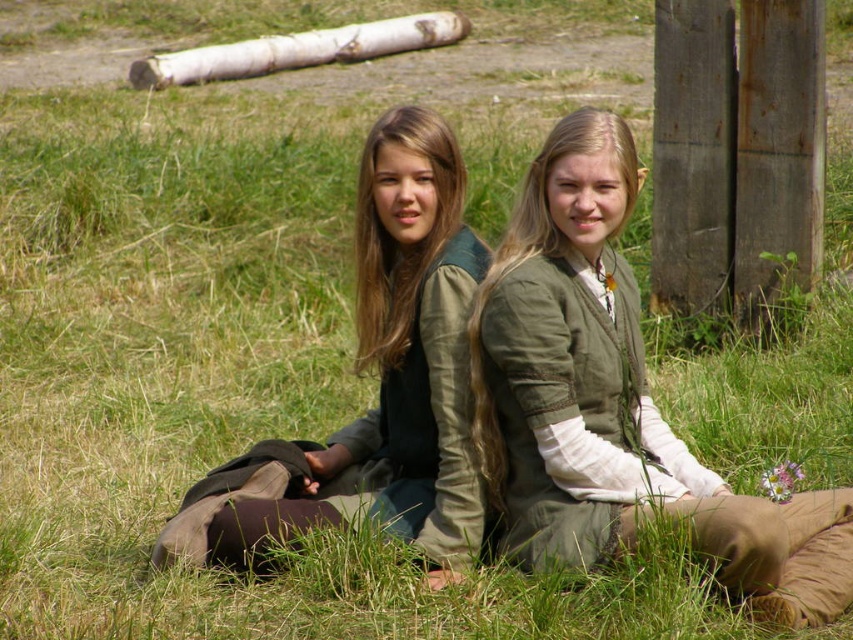
You are standing at the center of the image and see a point marked at coordinates (614, 403). Which object is this point located on?

The point at coordinates (614, 403) is located on the green linen tunic at center.

You are a tailor trying to determine which garment to display first in a medieval clothing exhibit. Given the green linen tunic at center and the matte green vest at center, which one is taller?

The green linen tunic at center is much taller than the matte green vest at center, so it should be displayed first as it is taller.